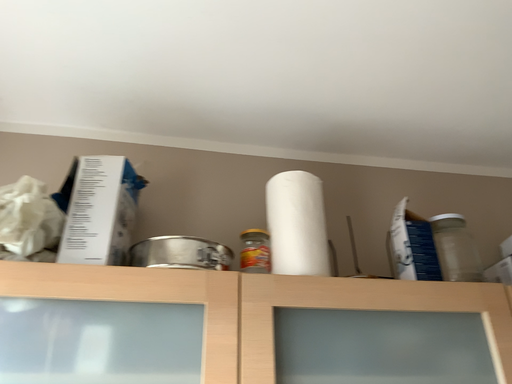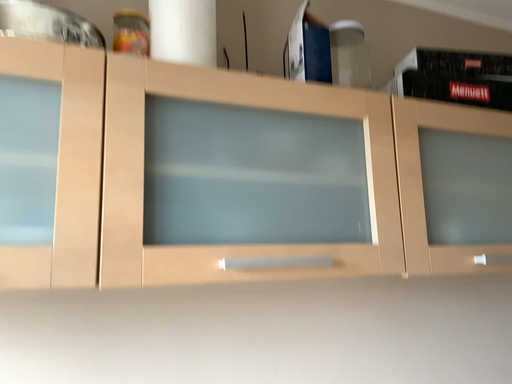
Question: How did the camera likely rotate when shooting the video?

Choices:
 (A) rotated right
 (B) rotated left

Answer: (A)